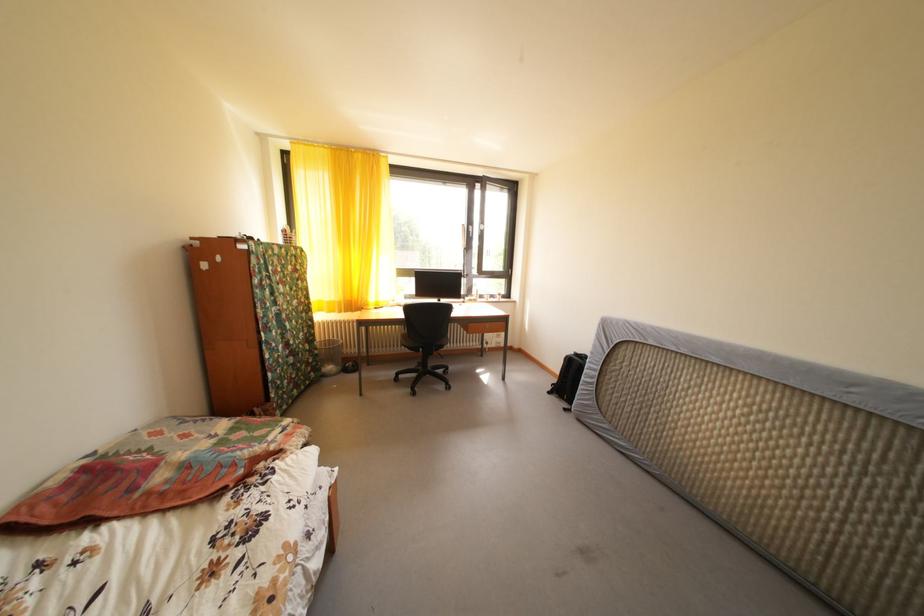
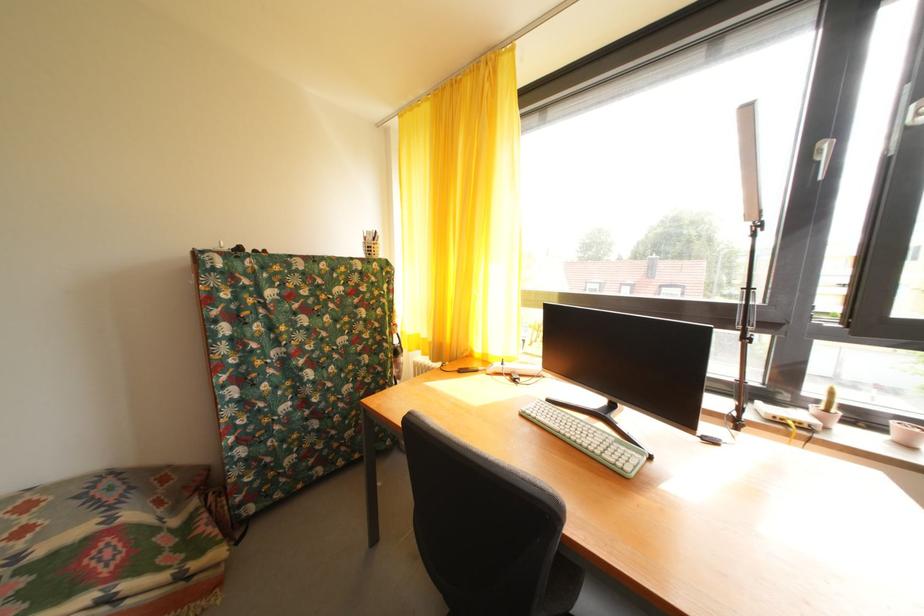
Locate, in the second image, the point that corresponds to (x=337, y=309) in the first image.

(432, 346)